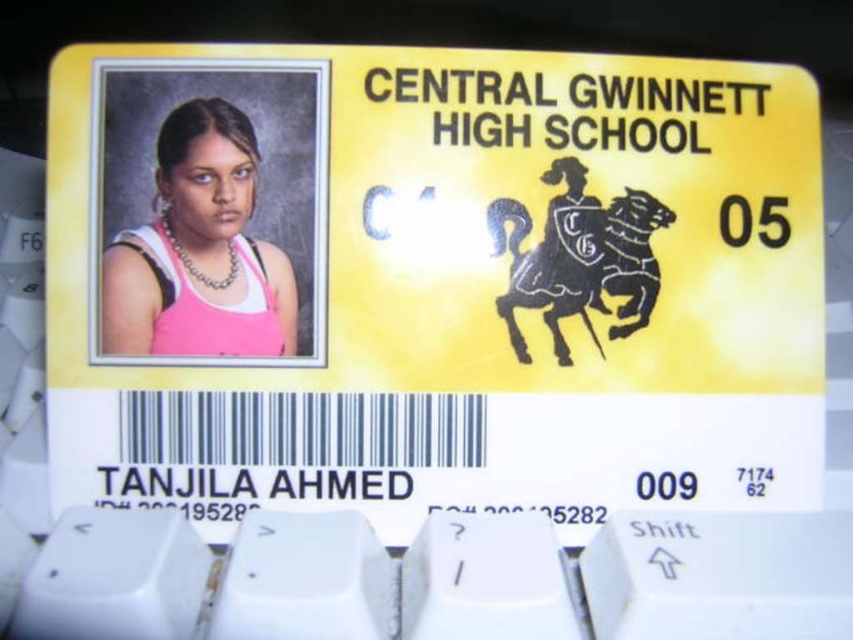
What are the coordinates of the yellow matte plastic id card at center?

The yellow matte plastic id card at center is located at point (432, 282).

You are examining a student ID card from Central Gwinnett High School. You notice two points marked on the card at coordinates point (489, 467) and point (125, 291). Which point is closer to the front of the card?

Point (489, 467) is further to the camera than point (125, 291), so point (125, 291) is closer to the front of the card.

You are holding a student ID card from Central Gwinnett High School. You want to place a sticker exactly at point [610,166] on the card. If the card is 3.5 inches wide and 2 inches tall, will the sticker be within the card?

The distance between point [610,166] and the camera is 18.03 inches. Since the card itself is only 3.5 inches wide and 2 inches tall, the sticker placed at point [610,166] will definitely be within the card as the coordinates are relative to the card dimensions.